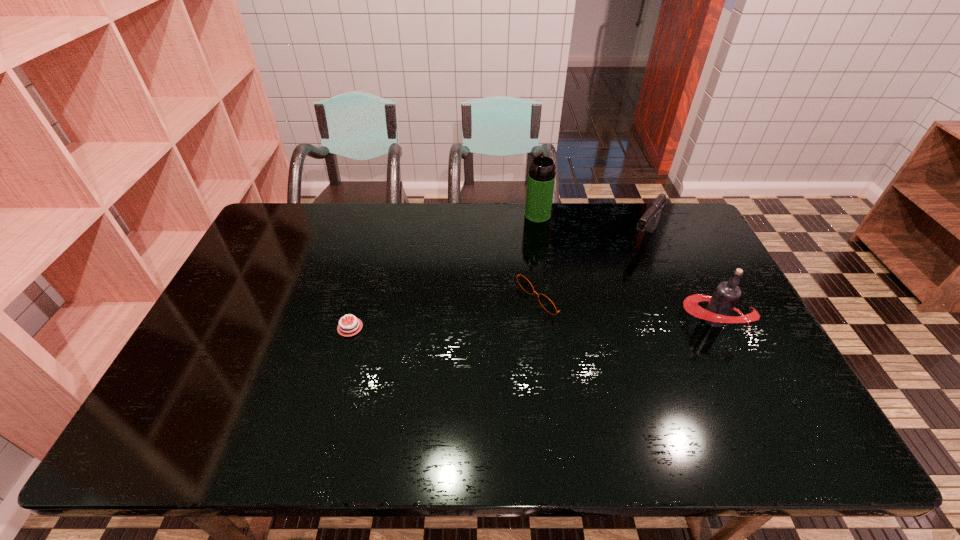
Image resolution: width=960 pixels, height=540 pixels. What are the coordinates of `root beer positioned at the right edge` in the screenshot? It's located at (726, 295).

Find the location of `pistol at the right edge`. pistol at the right edge is located at coordinates (649, 221).

Image resolution: width=960 pixels, height=540 pixels. Find the location of `object present at the far right corner`. object present at the far right corner is located at coordinates (649, 221).

At what (x,y) coordinates should I click in order to perform the action: click on free region at the far edge of the desktop. Please return your answer as a coordinate pair (x, y). Looking at the image, I should click on (344, 211).

This screenshot has width=960, height=540. What are the coordinates of `free point at the near edge` in the screenshot? It's located at (494, 387).

I want to click on vacant space at the left edge of the desktop, so click(279, 295).

Identify the location of vacant area at the right edge. The image size is (960, 540). (742, 343).

The image size is (960, 540). In the image, there is a desktop. What are the coordinates of `vacant space at the far left corner` in the screenshot? It's located at (279, 244).

In the image, there is a desktop. Identify the location of vacant space at the near left corner. The height and width of the screenshot is (540, 960). [184, 385].

In the image, there is a desktop. At what (x,y) coordinates should I click in order to perform the action: click on blank space at the far right corner. Please return your answer as a coordinate pair (x, y). Looking at the image, I should click on (669, 235).